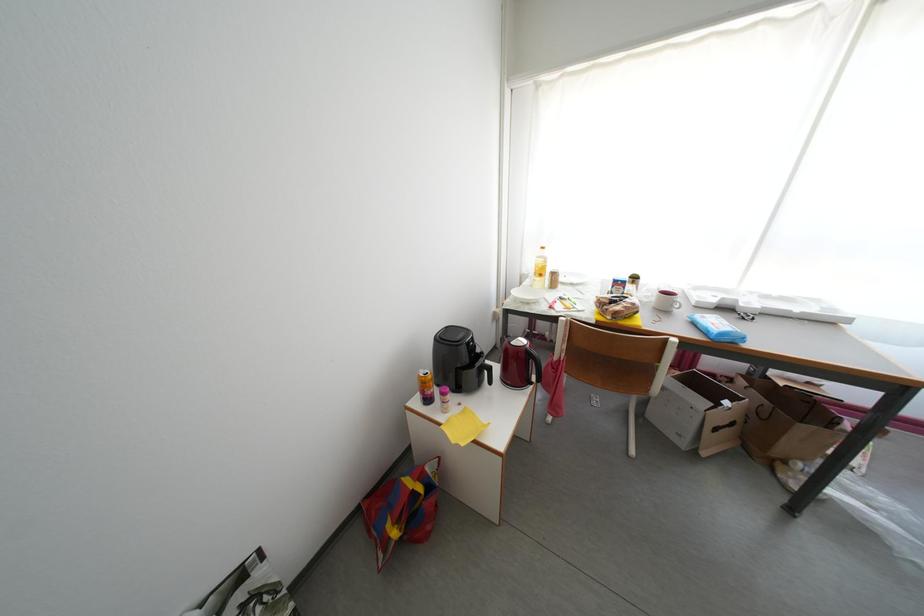
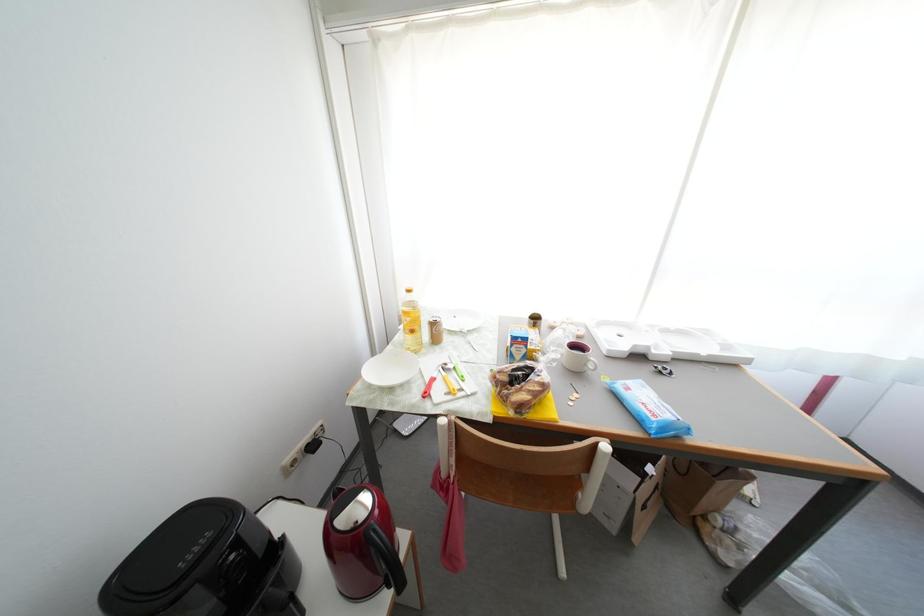
Question: The camera is either moving clockwise (left) or counter-clockwise (right) around the object. The first image is from the beginning of the video and the second image is from the end. Is the camera moving left or right when shooting the video?

Choices:
 (A) Left
 (B) Right

Answer: (A)